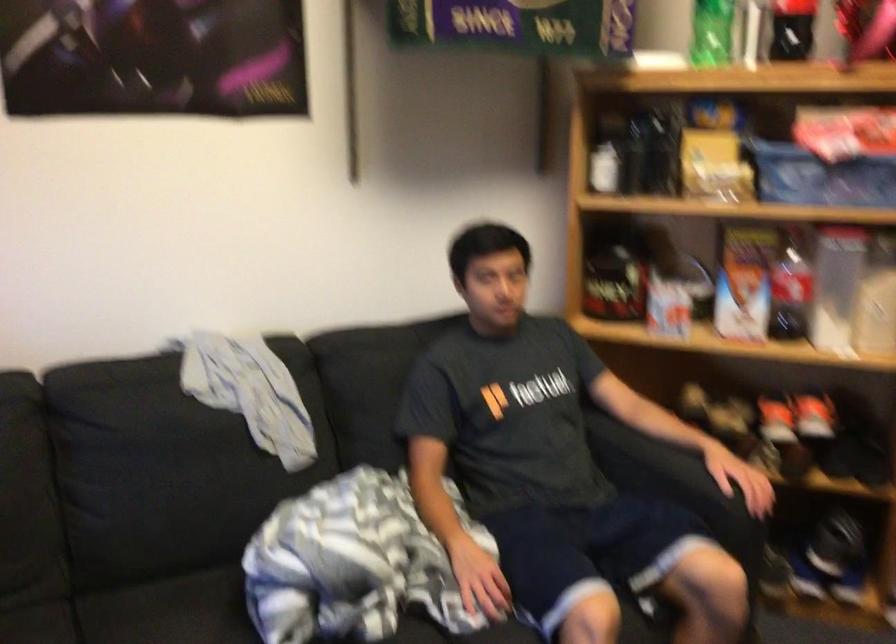
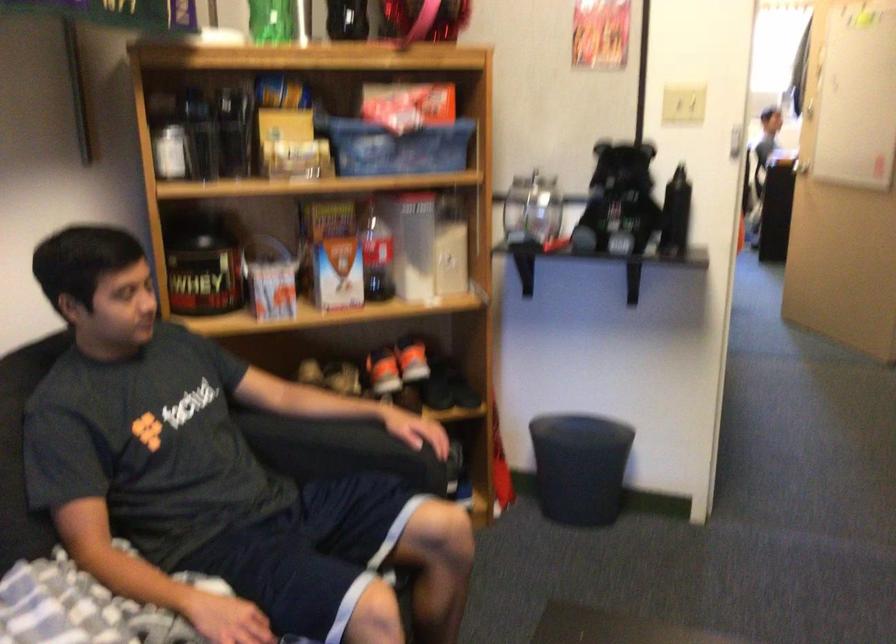
Locate, in the second image, the point that corresponds to [772,411] in the first image.

(383, 371)